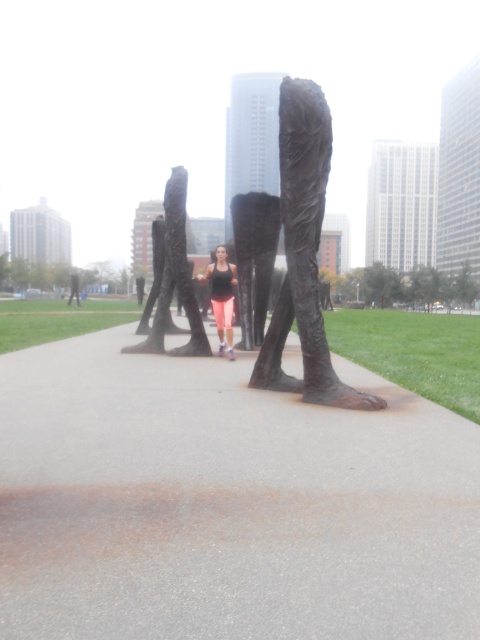
Question: Which object appears farthest from the camera in this image?

Choices:
 (A) gray concrete pavement at center
 (B) bronze/sculpture at center

Answer: (B)

Question: Which of the following is the farthest from the observer?

Choices:
 (A) matte black tank top at center
 (B) bronze statue at center
 (C) gray concrete pavement at center
 (D) bronze/sculpture at center

Answer: (A)

Question: Considering the real-world distances, which object is farthest from the bronze/sculpture at center?

Choices:
 (A) gray concrete pavement at center
 (B) matte black tank top at center

Answer: (B)

Question: Can you confirm if bronze statue at center is bigger than matte black tank top at center?

Choices:
 (A) yes
 (B) no

Answer: (B)

Question: Can you confirm if gray concrete pavement at center is wider than bronze statue at center?

Choices:
 (A) no
 (B) yes

Answer: (B)

Question: Can you confirm if gray concrete pavement at center is positioned to the left of bronze/sculpture at center?

Choices:
 (A) yes
 (B) no

Answer: (A)